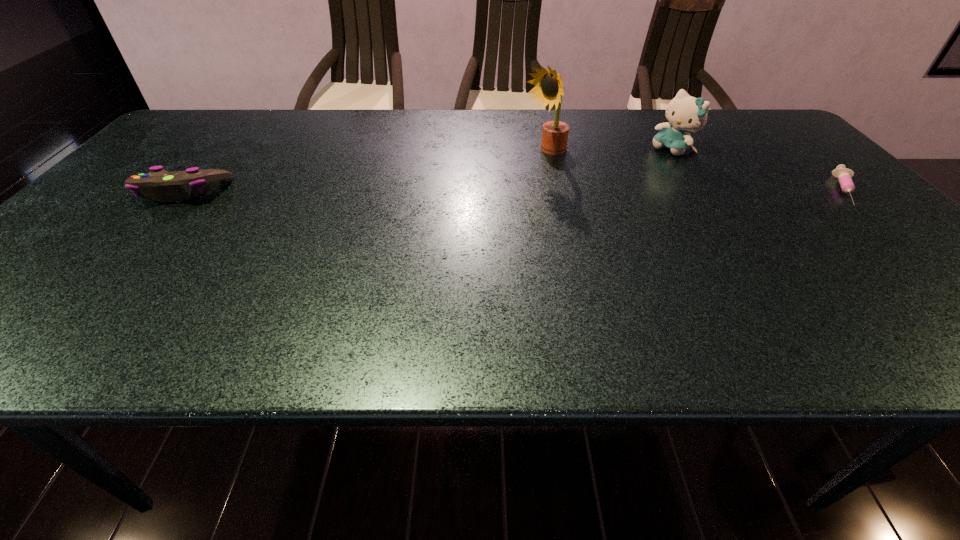
Identify the location of control. Image resolution: width=960 pixels, height=540 pixels. (159, 184).

You are a GUI agent. You are given a task and a screenshot of the screen. Output one action in this format:
    pyautogui.click(x=<x>, y=<y>)
    Task: Click on the leftmost object
    
    Given the screenshot: What is the action you would take?
    pyautogui.click(x=159, y=184)

What are the coordinates of `syringe` in the screenshot? It's located at click(844, 175).

Where is `the rightmost object`? This screenshot has width=960, height=540. the rightmost object is located at coordinates (844, 175).

Find the location of a particular element. The image size is (960, 540). the tallest object is located at coordinates (548, 88).

Identify the location of sunflower. (548, 88).

This screenshot has height=540, width=960. In order to click on the third shortest object in this screenshot , I will do `click(685, 113)`.

The width and height of the screenshot is (960, 540). I want to click on kitten, so click(x=685, y=113).

At what (x,y) coordinates should I click in order to perform the action: click on free region located 0.160m on the right of the third tallest object. Please return your answer as a coordinate pair (x, y). This screenshot has height=540, width=960. Looking at the image, I should click on (291, 192).

Identify the location of vacant space located on the left of the shortest object. Image resolution: width=960 pixels, height=540 pixels. (682, 191).